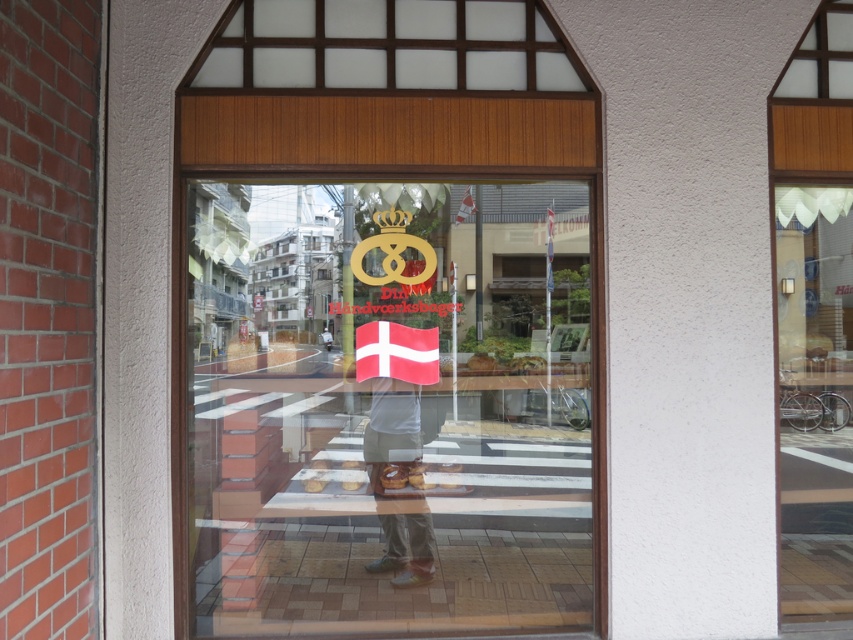
Question: Which of the following is the farthest from the observer?

Choices:
 (A) (828, 352)
 (B) (393, 529)
 (C) (248, 465)

Answer: (A)

Question: Can you confirm if transparent glass door at center is positioned to the left of denim pants at center?

Choices:
 (A) yes
 (B) no

Answer: (B)

Question: Is transparent glass door at center below denim pants at center?

Choices:
 (A) no
 (B) yes

Answer: (A)

Question: Based on their relative distances, which object is nearer to the denim pants at center?

Choices:
 (A) transparent glass door at center
 (B) clear glass door at right

Answer: (A)

Question: Is transparent glass door at center in front of clear glass door at right?

Choices:
 (A) no
 (B) yes

Answer: (B)

Question: Considering the real-world distances, which object is closest to the transparent glass door at center?

Choices:
 (A) clear glass door at right
 (B) denim pants at center

Answer: (B)